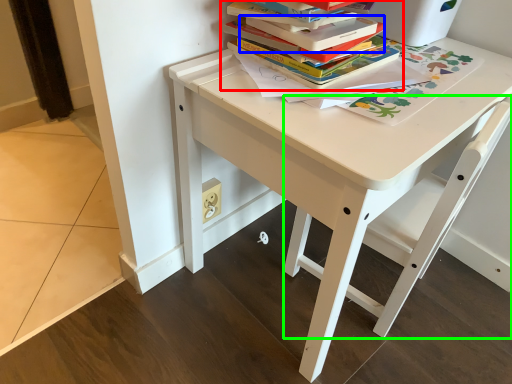
Question: Which is nearer to the book (highlighted by a red box)? paperback book (highlighted by a blue box) or chair (highlighted by a green box).

Choices:
 (A) paperback book
 (B) chair

Answer: (A)